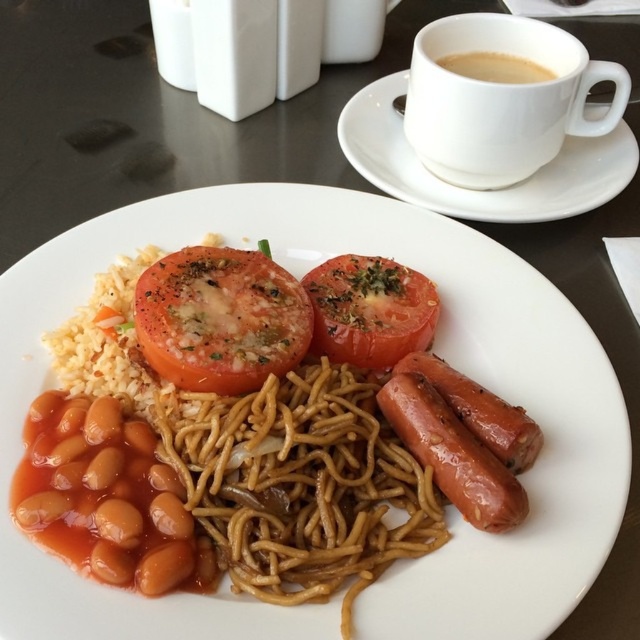
You are a food critic standing 40 inches away from the plate. Can you see the slightly charred tomato at center clearly?

The slightly charred tomato at center is 37.92 inches away from the camera, so yes, you can see it clearly since you are standing 40 inches away, which is just slightly farther than the tomato.

You are a food critic observing a plate of food. You see the brown matte noodles at center and the brown glossy beans at lower left. Which component is positioned higher on the plate?

The brown matte noodles at center is positioned higher than the brown glossy beans at lower left because it is located above it on the plate.

Consider the image. You are a food critic evaluating the portion sizes of the meal. Which component, the slightly charred tomato at center or the brown glossy beans at lower left, would you describe as having a bigger portion?

The slightly charred tomato at center has a larger portion than the brown glossy beans at lower left according to the description.